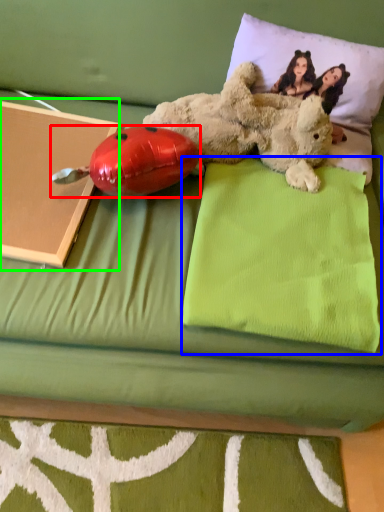
Question: Based on their relative distances, which object is nearer to ladybug (highlighted by a red box)? Choose from pillow (highlighted by a blue box) and paperback book (highlighted by a green box).

Choices:
 (A) pillow
 (B) paperback book

Answer: (B)